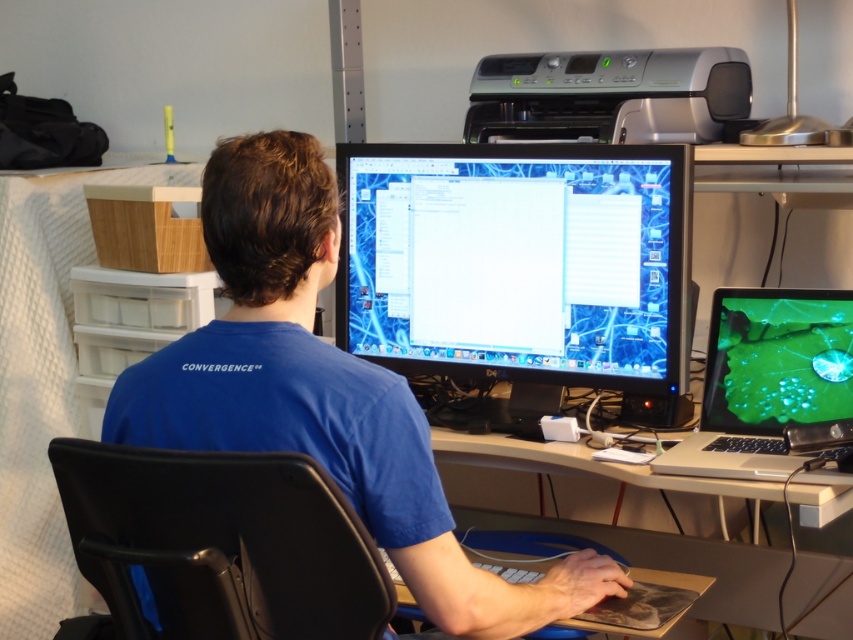
Question: Which point appears farthest from the camera in this image?

Choices:
 (A) (376, 573)
 (B) (410, 269)

Answer: (B)

Question: Does smooth wooden table at center appear on the right side of silver/black plastic printer at upper center?

Choices:
 (A) yes
 (B) no

Answer: (A)

Question: Which is nearer to the blue cotton shirt at center?

Choices:
 (A) black leather chair at center
 (B) shiny silver laptop at lower right
 (C) smooth wooden table at center
 (D) matte black monitor at center

Answer: (A)

Question: Which of the following is the farthest from the observer?

Choices:
 (A) shiny silver laptop at lower right
 (B) smooth wooden table at center
 (C) black leather chair at center
 (D) silver/black plastic printer at upper center

Answer: (B)

Question: Does blue cotton shirt at center lie in front of black leather chair at center?

Choices:
 (A) yes
 (B) no

Answer: (B)

Question: Where is black leather chair at center located in relation to smooth wooden table at center in the image?

Choices:
 (A) left
 (B) right

Answer: (A)